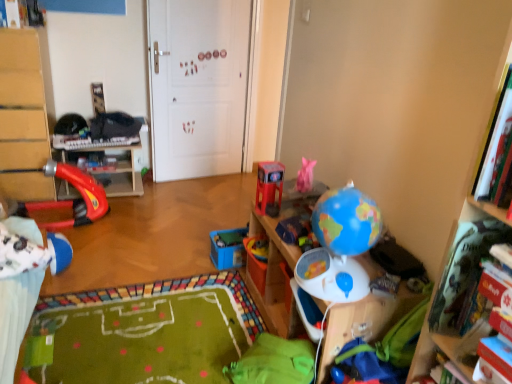
What do you see at coordinates (198, 86) in the screenshot?
I see `white matte door at center` at bounding box center [198, 86].

What is the approximate height of rubber yellow toy car at center, the third toy from the left?

2.04 inches.

What do you see at coordinates (257, 247) in the screenshot? I see `rubber yellow toy car at center, the third toy from the left` at bounding box center [257, 247].

What do you see at coordinates (297, 232) in the screenshot? I see `blue plastic globe at center, placed as the fifth toy when sorted from left to right` at bounding box center [297, 232].

In order to face shiny red toy car at center, acting as the fourth toy starting from the right, should I rotate leftwards or rightwards?

Rotate your view right by about 1.881°.

You are a GUI agent. You are given a task and a screenshot of the screen. Output one action in this format:
    pyautogui.click(x=<x>, y=<y>)
    Task: Click on the blue rubber ball at lower right, arranged as the 7th toy when viewed from the left
    The height and width of the screenshot is (384, 512).
    Given the screenshot: What is the action you would take?
    [366, 364]

I want to click on white matte door at center, so click(x=198, y=86).

In the image, is matte plastic book at left, the 1th book in the back-to-front sequence, on the left side or the right side of blue rubber ball at lower right, which is counted as the first toy, starting from the right?

In the image, matte plastic book at left, the 1th book in the back-to-front sequence, appears on the left side of blue rubber ball at lower right, which is counted as the first toy, starting from the right.

Is the position of matte plastic book at left, the second book when ordered from right to left, less distant than that of blue rubber ball at lower right, arranged as the 7th toy when viewed from the left?

No, matte plastic book at left, the second book when ordered from right to left, is further to the viewer.

Which of these two, matte plastic book at left, the second book when ordered from right to left, or blue rubber ball at lower right, arranged as the 7th toy when viewed from the left, stands taller?

With more height is blue rubber ball at lower right, arranged as the 7th toy when viewed from the left.

Would you consider rubberized red slide at left to be distant from hardcover book at right, positioned as the 2th book in back-to-front order?

Yes, rubberized red slide at left and hardcover book at right, positioned as the 2th book in back-to-front order, are quite far apart.

From a real-world perspective, is rubberized red slide at left below hardcover book at right, arranged as the 1th book when viewed from the right?

Yes, from a real-world perspective, rubberized red slide at left is below hardcover book at right, arranged as the 1th book when viewed from the right.

From the image's perspective, is rubberized red slide at left positioned above or below hardcover book at right, which is the first book from bottom to top?

Based on their image positions, rubberized red slide at left is located above hardcover book at right, which is the first book from bottom to top.

At what (x,y) coordinates should I click in order to perform the action: click on table that is under the hardcover book at right, which is the first book from bottom to top (from a real-world perspective). Please return your answer as a coordinate pair (x, y). Image resolution: width=512 pixels, height=384 pixels. Looking at the image, I should click on (112, 168).

Do you think blue rubber ball at lower right, arranged as the 7th toy when viewed from the left, is within hardcover book at right, positioned as the 2th book in back-to-front order, or outside of it?

blue rubber ball at lower right, arranged as the 7th toy when viewed from the left, is outside hardcover book at right, positioned as the 2th book in back-to-front order.

Could you measure the distance between blue rubber ball at lower right, which is counted as the first toy, starting from the right, and hardcover book at right, which is the first book from bottom to top?

blue rubber ball at lower right, which is counted as the first toy, starting from the right, and hardcover book at right, which is the first book from bottom to top, are 16.90 inches apart from each other.

Does blue rubber ball at lower right, arranged as the 7th toy when viewed from the left, appear on the left side of hardcover book at right, arranged as the 1th book when viewed from the right?

Yes.

From the picture: Can you confirm if blue rubber ball at lower right, which is counted as the first toy, starting from the right, is taller than hardcover book at right, positioned as the 2th book in back-to-front order?

In fact, blue rubber ball at lower right, which is counted as the first toy, starting from the right, may be shorter than hardcover book at right, positioned as the 2th book in back-to-front order.

Considering the sizes of hardcover book at right, which is the first book from bottom to top, and blue matte globe at right, acting as the 2th toy starting from the right, in the image, is hardcover book at right, which is the first book from bottom to top, wider or thinner than blue matte globe at right, acting as the 2th toy starting from the right,?

Considering their sizes, hardcover book at right, which is the first book from bottom to top, looks slimmer than blue matte globe at right, acting as the 2th toy starting from the right.

The image size is (512, 384). In order to click on toy that is the 2nd one when counting upward from the hardcover book at right, positioned as the 2th book in back-to-front order (from the image's perspective) in this screenshot , I will do `click(340, 246)`.

Considering the relative sizes of hardcover book at right, which is the first book from bottom to top, and blue matte globe at right, marked as the 6th toy in a left-to-right arrangement, in the image provided, is hardcover book at right, which is the first book from bottom to top, taller than blue matte globe at right, marked as the 6th toy in a left-to-right arrangement,?

No.

From a real-world perspective, which is physically above, hardcover book at right, which is counted as the 1th book, starting from the front, or shiny red toy car at center, acting as the fourth toy starting from the right?

hardcover book at right, which is counted as the 1th book, starting from the front.

Based on their positions, is hardcover book at right, positioned as the second book in top-to-bottom order, located to the left or right of shiny red toy car at center, acting as the fourth toy starting from the right?

In the image, hardcover book at right, positioned as the second book in top-to-bottom order, appears on the right side of shiny red toy car at center, acting as the fourth toy starting from the right.

There is a shiny red toy car at center, the fourth toy from the left. At what (x,y) coordinates should I click in order to perform the action: click on book above it (from a real-world perspective). Please return your answer as a coordinate pair (x, y). The height and width of the screenshot is (384, 512). Looking at the image, I should click on (465, 276).

Is hardcover book at right, arranged as the 1th book when viewed from the right, thinner than shiny red toy car at center, the fourth toy from the left?

Incorrect, the width of hardcover book at right, arranged as the 1th book when viewed from the right, is not less than that of shiny red toy car at center, the fourth toy from the left.

Considering the positions of objects rubber yellow toy car at center, the third toy from the left, and green fabric bean bag at lower center in the image provided, who is behind, rubber yellow toy car at center, the third toy from the left, or green fabric bean bag at lower center?

Positioned behind is rubber yellow toy car at center, the third toy from the left.

Considering the sizes of rubber yellow toy car at center, the third toy from the left, and green fabric bean bag at lower center in the image, is rubber yellow toy car at center, the third toy from the left, wider or thinner than green fabric bean bag at lower center?

Clearly, rubber yellow toy car at center, the third toy from the left, has less width compared to green fabric bean bag at lower center.

Locate an element on the screen. The width and height of the screenshot is (512, 384). bean bag chair lying on the right of rubber yellow toy car at center, the fifth toy in the right-to-left sequence is located at coordinates (274, 362).

From the image's perspective, is rubber yellow toy car at center, the fifth toy in the right-to-left sequence, located above or below green fabric bean bag at lower center?

From the image's perspective, rubber yellow toy car at center, the fifth toy in the right-to-left sequence, appears above green fabric bean bag at lower center.

Find the location of a particular element. This screenshot has width=512, height=384. door to the left of shiny red toy car at center, acting as the fourth toy starting from the right is located at coordinates (198, 86).

Relative to shiny red toy car at center, acting as the fourth toy starting from the right, is white matte door at center in front or behind?

white matte door at center is positioned farther from the viewer than shiny red toy car at center, acting as the fourth toy starting from the right.

Which is nearer, (206, 163) or (263, 207)?

The point (263, 207) is in front.

Find the location of `book located on the left of blue rubber ball at lower right, which is counted as the first toy, starting from the right`. book located on the left of blue rubber ball at lower right, which is counted as the first toy, starting from the right is located at coordinates (105, 162).

This screenshot has width=512, height=384. What are the coordinates of `book that is the 2nd one when counting downward from the rubberized red slide at left (from the image's perspective)` in the screenshot? It's located at (465, 276).

Based on the photo, when comparing their distances from hardcover book at right, which is counted as the 1th book, starting from the front, does blue plastic globe at center, placed as the fifth toy when sorted from left to right, or blue plastic toy at center, arranged as the sixth toy when viewed from the right, seem closer?

The object closer to hardcover book at right, which is counted as the 1th book, starting from the front, is blue plastic globe at center, placed as the fifth toy when sorted from left to right.

Looking at this image, based on their spatial positions, is white matte door at center or brown wooden shelf at left further from shiny red toy car at center, the fourth toy from the left?

brown wooden shelf at left is positioned further to the anchor shiny red toy car at center, the fourth toy from the left.

Estimate the real-world distances between objects in this image. Which object is closer to blue plastic globe at center, arranged as the third toy when viewed from the right, rubber yellow toy car at center, the fifth toy in the right-to-left sequence, or blue plastic toy at center, arranged as the sixth toy when viewed from the right?

Among the two, rubber yellow toy car at center, the fifth toy in the right-to-left sequence, is located nearer to blue plastic globe at center, arranged as the third toy when viewed from the right.

Based on the photo, considering their positions, is blue plastic toy at center, arranged as the sixth toy when viewed from the right, positioned closer to brown wooden shelf at left than blue rubber ball at lower right, which is counted as the first toy, starting from the right?

The object closer to brown wooden shelf at left is blue plastic toy at center, arranged as the sixth toy when viewed from the right.

Which object lies further to the anchor point hardcover book at right, arranged as the 1th book when viewed from the right, white matte door at center or rubber yellow toy car at center, the fifth toy in the right-to-left sequence?

The object further to hardcover book at right, arranged as the 1th book when viewed from the right, is white matte door at center.

Which object lies further to the anchor point hardcover book at right, arranged as the 1th book when viewed from the right, brown wooden shelf at left or green fabric bean bag at lower center?

brown wooden shelf at left is further to hardcover book at right, arranged as the 1th book when viewed from the right.

Based on their spatial positions, is brown wooden shelf at left or blue matte globe at right, marked as the 6th toy in a left-to-right arrangement, closer to blue rubber ball at lower right, arranged as the 7th toy when viewed from the left?

Among the two, blue matte globe at right, marked as the 6th toy in a left-to-right arrangement, is located nearer to blue rubber ball at lower right, arranged as the 7th toy when viewed from the left.

Estimate the real-world distances between objects in this image. Which object is further from rubberized red slide at left, brown wooden shelf at left or white matte door at center?

The object further to rubberized red slide at left is white matte door at center.

Image resolution: width=512 pixels, height=384 pixels. I want to click on book between brown wooden shelf at left and blue rubber ball at lower right, which is counted as the first toy, starting from the right, so click(105, 162).

At what (x,y) coordinates should I click in order to perform the action: click on table situated between rubberized red slide at left, arranged as the first toy when viewed from the left, and white matte door at center from left to right. Please return your answer as a coordinate pair (x, y). Looking at the image, I should click on coord(112,168).

At what (x,y) coordinates should I click in order to perform the action: click on door between blue rubber ball at lower right, which is counted as the first toy, starting from the right, and matte plastic book at left, the second book when ordered from right to left, from front to back. Please return your answer as a coordinate pair (x, y). Looking at the image, I should click on (198, 86).

You are a GUI agent. You are given a task and a screenshot of the screen. Output one action in this format:
    pyautogui.click(x=<x>, y=<y>)
    Task: Click on the book situated between brown wooden shelf at left and blue matte globe at right, acting as the 2th toy starting from the right, from left to right
    This screenshot has width=512, height=384.
    Given the screenshot: What is the action you would take?
    pyautogui.click(x=105, y=162)